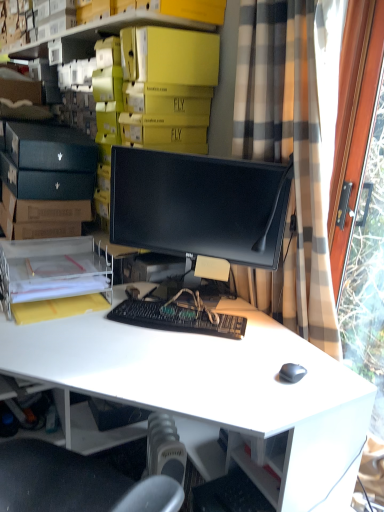
Question: From a real-world perspective, is clear plastic file at lower left below yellow cardboard boxes at upper center?

Choices:
 (A) yes
 (B) no

Answer: (A)

Question: Does clear plastic file at lower left come behind yellow cardboard boxes at upper center?

Choices:
 (A) yes
 (B) no

Answer: (B)

Question: Could you tell me if clear plastic file at lower left is facing yellow cardboard boxes at upper center?

Choices:
 (A) yes
 (B) no

Answer: (B)

Question: Considering the relative sizes of clear plastic file at lower left and yellow cardboard boxes at upper center in the image provided, is clear plastic file at lower left bigger than yellow cardboard boxes at upper center?

Choices:
 (A) no
 (B) yes

Answer: (A)

Question: Is clear plastic file at lower left outside yellow cardboard boxes at upper center?

Choices:
 (A) yes
 (B) no

Answer: (A)

Question: Considering the positions of point (59, 53) and point (326, 79), is point (59, 53) closer or farther from the camera than point (326, 79)?

Choices:
 (A) closer
 (B) farther

Answer: (B)

Question: From a real-world perspective, is yellow cardboard boxes at upper center above or below plaid fabric curtain at right?

Choices:
 (A) below
 (B) above

Answer: (B)

Question: Considering the relative positions of yellow cardboard boxes at upper center and plaid fabric curtain at right in the image provided, is yellow cardboard boxes at upper center to the left or to the right of plaid fabric curtain at right?

Choices:
 (A) left
 (B) right

Answer: (A)

Question: In the image, is yellow cardboard boxes at upper center positioned in front of or behind plaid fabric curtain at right?

Choices:
 (A) front
 (B) behind

Answer: (B)

Question: In the image, is black matte monitor at center positioned in front of or behind plaid fabric curtain at right?

Choices:
 (A) behind
 (B) front

Answer: (A)

Question: Does point (175, 153) appear closer or farther from the camera than point (299, 142)?

Choices:
 (A) closer
 (B) farther

Answer: (B)

Question: Is black matte monitor at center bigger or smaller than plaid fabric curtain at right?

Choices:
 (A) big
 (B) small

Answer: (B)

Question: In terms of height, does black matte monitor at center look taller or shorter compared to plaid fabric curtain at right?

Choices:
 (A) short
 (B) tall

Answer: (A)

Question: Is plaid fabric curtain at right wider or thinner than white matte desk at center?

Choices:
 (A) thin
 (B) wide

Answer: (A)

Question: Looking at the image, does plaid fabric curtain at right seem bigger or smaller compared to white matte desk at center?

Choices:
 (A) big
 (B) small

Answer: (B)